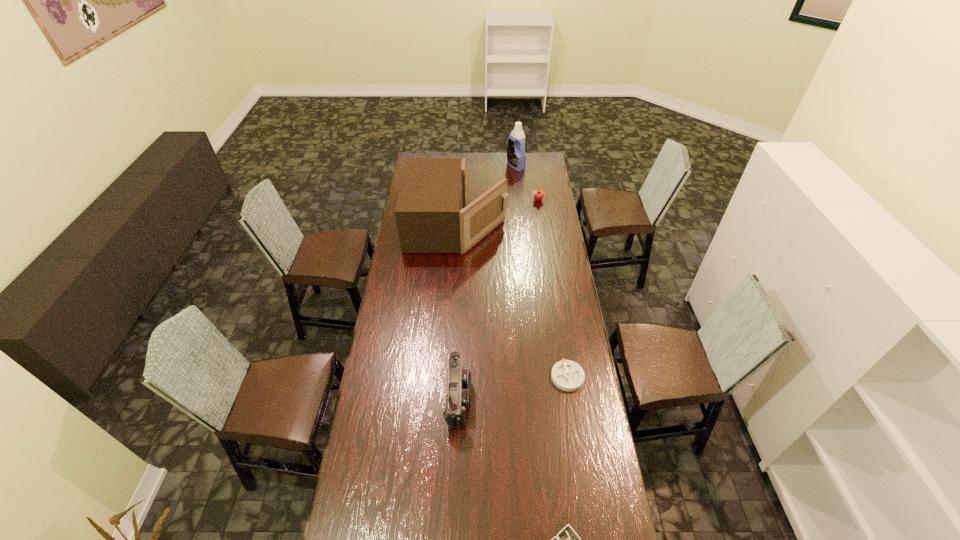
At what (x,y) coordinates should I click in order to perform the action: click on the farthest object. Please return your answer as a coordinate pair (x, y). Image resolution: width=960 pixels, height=540 pixels. Looking at the image, I should click on (516, 158).

The image size is (960, 540). In order to click on microwave oven in this screenshot , I will do (x=432, y=217).

Image resolution: width=960 pixels, height=540 pixels. I want to click on the third tallest object, so click(458, 399).

At what (x,y) coordinates should I click in order to perform the action: click on the fourth tallest object. Please return your answer as a coordinate pair (x, y). The width and height of the screenshot is (960, 540). Looking at the image, I should click on (538, 194).

At what (x,y) coordinates should I click in order to perform the action: click on the farther ashtray. Please return your answer as a coordinate pair (x, y). The width and height of the screenshot is (960, 540). Looking at the image, I should click on tap(567, 375).

In order to click on vacant space situated 0.310m on the front of the farthest object in this screenshot , I will do `click(519, 201)`.

The image size is (960, 540). What are the coordinates of `vacant space located with the door open on the front of the microwave oven` in the screenshot? It's located at (533, 225).

Identify the location of vacant position located on the front-facing side of the fourth shortest object. The image size is (960, 540). pyautogui.click(x=541, y=397).

Find the location of a particular element. vacant area located on the front of the apple is located at coordinates (541, 222).

Locate an element on the screen. This screenshot has height=540, width=960. vacant region located on the front of the farther ashtray is located at coordinates (583, 478).